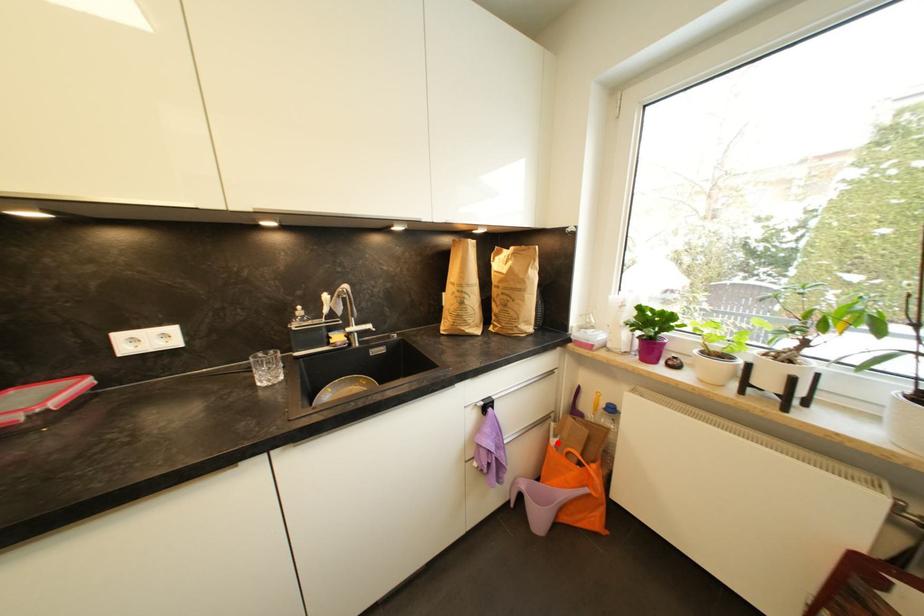
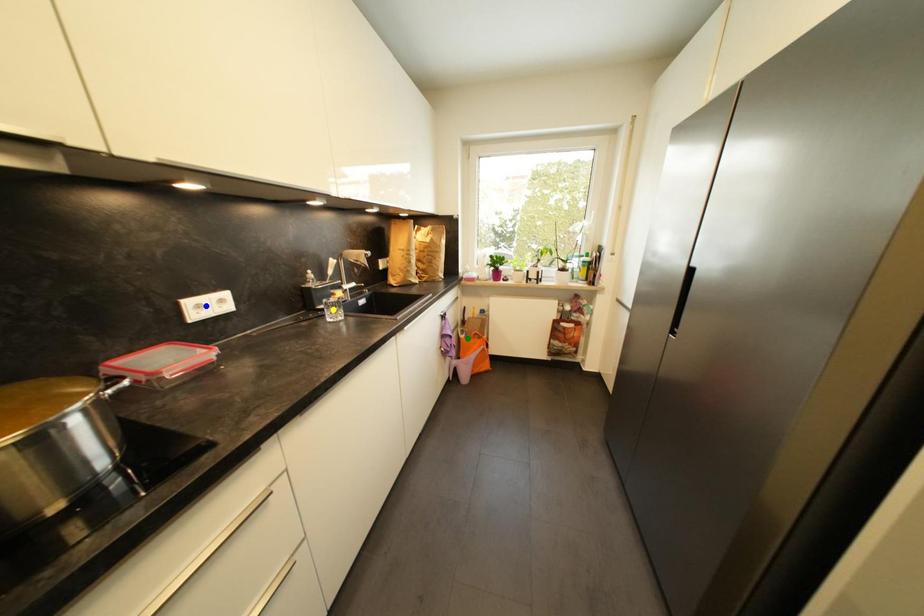
Question: I am providing you with two images of the same scene from different viewpoints. A red point is marked on the first image. You are given multiple points on the second image. Which point in image 2 represents the same 3d spot as the red point in image 1?

Choices:
 (A) yellow point
 (B) blue point
 (C) green point

Answer: (C)